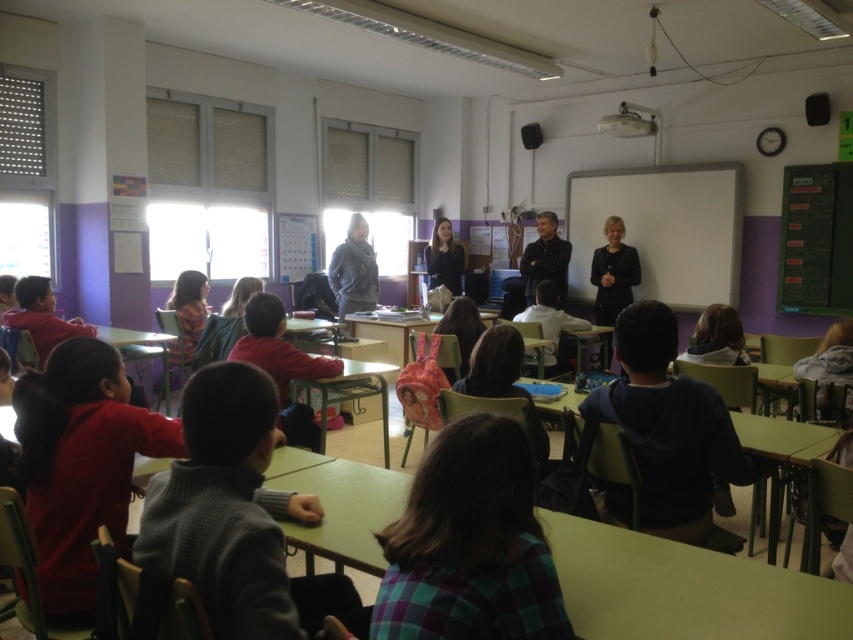
Question: Which point appears farthest from the camera in this image?

Choices:
 (A) (321, 406)
 (B) (746, 435)
 (C) (654, 369)
 (D) (560, 305)

Answer: (D)

Question: Does green matte table at center appear on the left side of dark blue fabric backpack at lower right?

Choices:
 (A) no
 (B) yes

Answer: (B)

Question: Which object appears closest to the camera in this image?

Choices:
 (A) green matte table at lower right
 (B) white matte/blackboard at upper center

Answer: (A)

Question: Which point is farther from the camera taking this photo?

Choices:
 (A) click(383, 412)
 (B) click(714, 220)
 (C) click(544, 227)

Answer: (C)

Question: Is green matte table at center further to camera compared to plaid fabric shirt at center?

Choices:
 (A) no
 (B) yes

Answer: (B)

Question: Where is plaid fabric shirt at center located in relation to dark gray sweater at center in the image?

Choices:
 (A) below
 (B) above

Answer: (A)